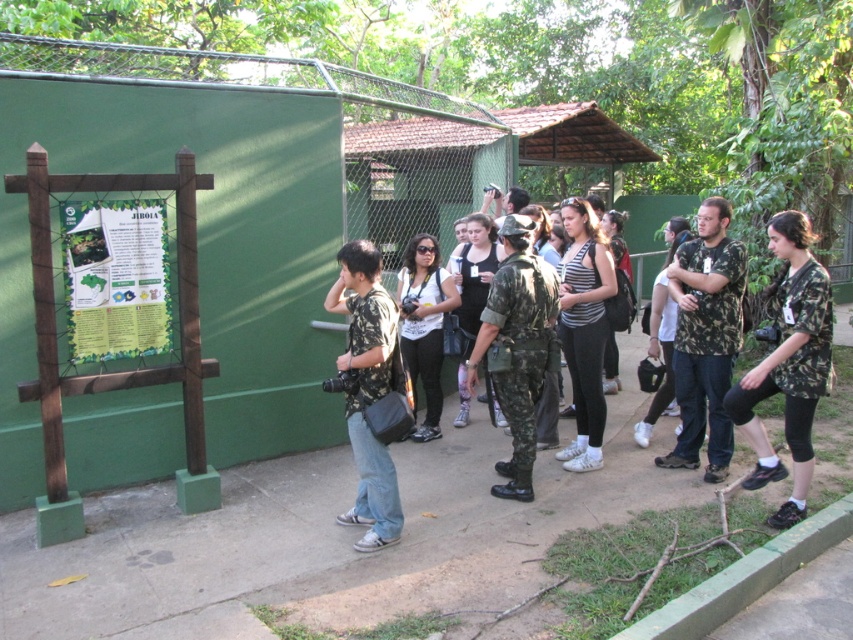
Question: Which point is closer to the camera?

Choices:
 (A) camo-patterned shirt at center
 (B) striped fabric shirt at center
 (C) wooden signboard at left
 (D) camo uniform at center

Answer: (A)

Question: Where is wooden signboard at left located in relation to green paper poster at left in the image?

Choices:
 (A) left
 (B) right

Answer: (B)

Question: Which object is positioned farthest from the camo uniform at center?

Choices:
 (A) camouflage shirt at right
 (B) camo-patterned shirt at center
 (C) green paper poster at left
 (D) camouflage uniform at center

Answer: (C)

Question: Is camouflage uniform at center further to the viewer compared to matte black camera at center?

Choices:
 (A) yes
 (B) no

Answer: (B)

Question: Which of the following is the farthest from the observer?

Choices:
 (A) (397, 529)
 (B) (9, 188)
 (C) (747, 413)
 (D) (601, 321)

Answer: (D)

Question: Can you confirm if wooden signboard at left is bigger than camo uniform at center?

Choices:
 (A) no
 (B) yes

Answer: (B)